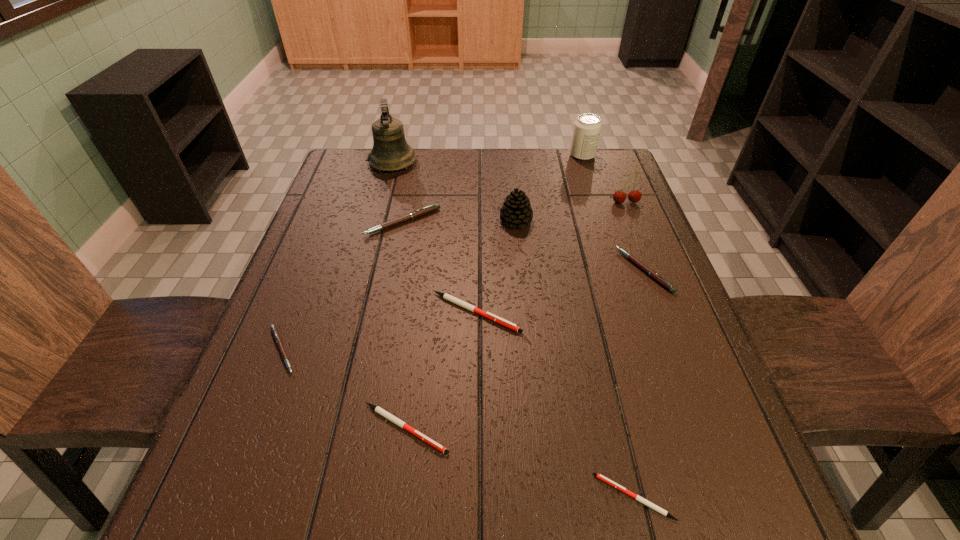
The width and height of the screenshot is (960, 540). I want to click on free region located 0.070m at the narrow end of the pinecone, so click(x=473, y=221).

Where is `vacant point located at the nib of the fifth tallest object`? This screenshot has height=540, width=960. vacant point located at the nib of the fifth tallest object is located at coordinates (374, 363).

You are a GUI agent. You are given a task and a screenshot of the screen. Output one action in this format:
    pyautogui.click(x=<x>, y=<y>)
    Task: Click on the vacant region located at the nib of the second biggest pink pen
    The width and height of the screenshot is (960, 540).
    Given the screenshot: What is the action you would take?
    pyautogui.click(x=534, y=271)

The width and height of the screenshot is (960, 540). Identify the location of vacant region located 0.380m at the nib of the second biggest pink pen. (462, 271).

Locate an element on the screen. The width and height of the screenshot is (960, 540). free space located 0.210m at the nib of the second biggest pink pen is located at coordinates pos(534,271).

Identify the location of vacant position located 0.150m on the clicker of the biggest white pen. The width and height of the screenshot is (960, 540). (590, 313).

The width and height of the screenshot is (960, 540). Find the location of `free space located 0.300m at the nib of the leftmost pen`. free space located 0.300m at the nib of the leftmost pen is located at coordinates (451, 350).

Locate an element on the screen. The height and width of the screenshot is (540, 960). blank area located on the clicker of the second nearest object is located at coordinates (664, 428).

Find the location of a particular element. vacant space located on the clicker of the rightmost white pen is located at coordinates (339, 497).

This screenshot has width=960, height=540. In order to click on vacant area situated on the clicker of the rightmost white pen in this screenshot , I will do `click(422, 497)`.